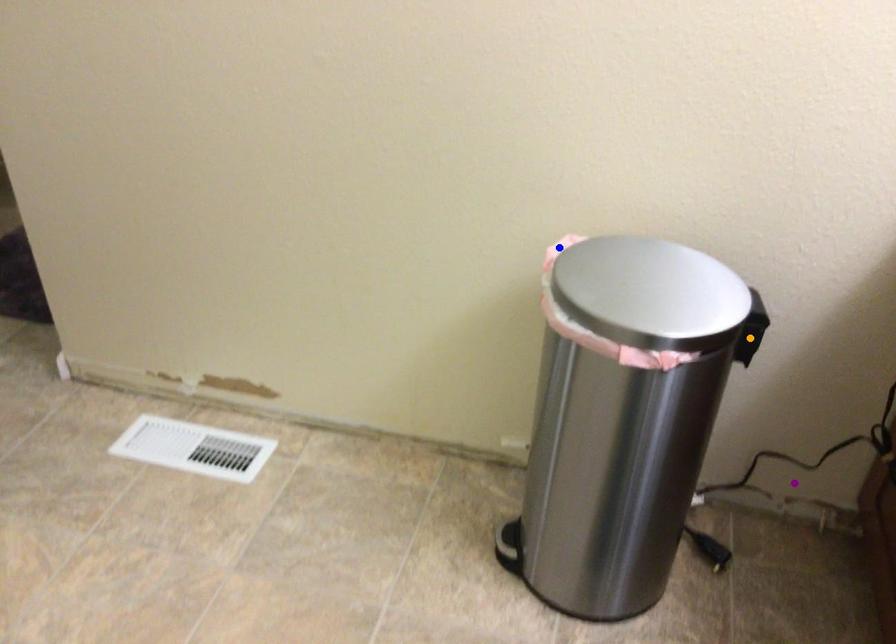
Order these from nearest to farthest:
purple point
blue point
orange point

purple point → blue point → orange point